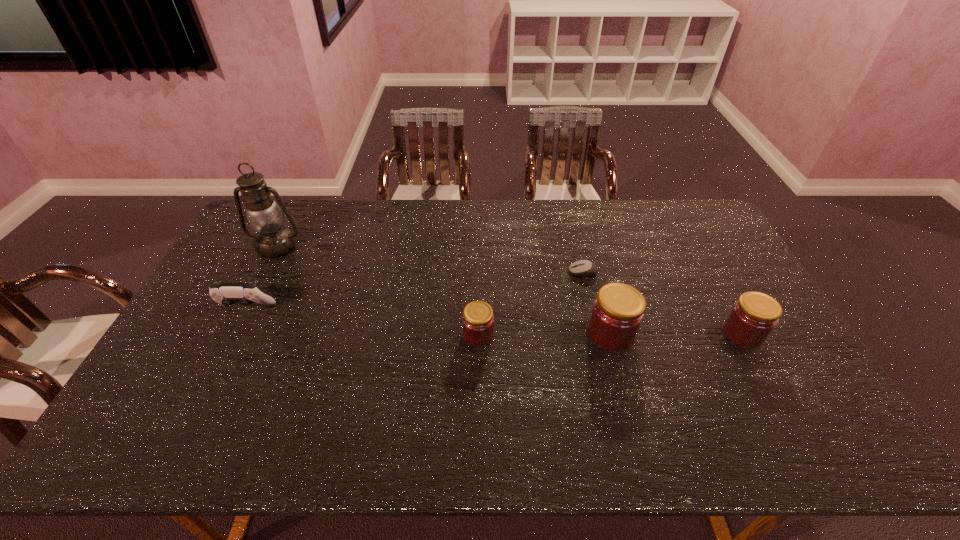
This screenshot has width=960, height=540. What are the coordinates of `blank space that satisfies the following two spatial constraints: 1. on the wheel side of the fifth nearest object; 2. on the back side of the second tallest object` in the screenshot? It's located at (598, 334).